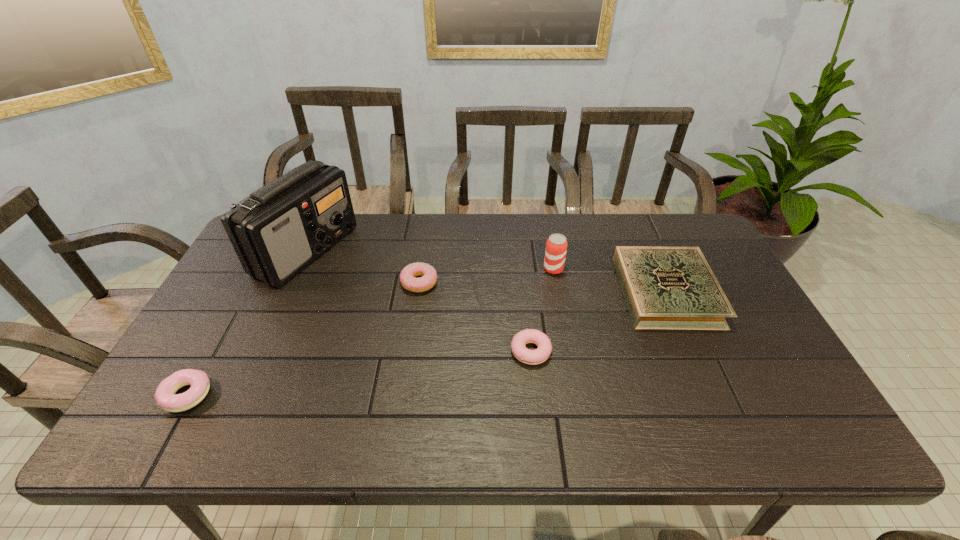
In order to click on empty location between the third object from left to right and the second object from right to left in this screenshot , I will do `click(487, 276)`.

Locate an element on the screen. The image size is (960, 540). unoccupied position between the second farthest doughnut and the tallest object is located at coordinates (419, 301).

The height and width of the screenshot is (540, 960). In order to click on free space that is in between the rightmost doughnut and the tallest object in this screenshot , I will do [x=419, y=301].

Identify the location of free area in between the second nearest doughnut and the fifth shortest object. This screenshot has height=540, width=960. (542, 310).

Image resolution: width=960 pixels, height=540 pixels. I want to click on free point between the second object from right to left and the rightmost object, so click(x=610, y=280).

Image resolution: width=960 pixels, height=540 pixels. I want to click on unoccupied area between the tallest object and the farthest doughnut, so click(x=363, y=267).

You are a GUI agent. You are given a task and a screenshot of the screen. Output one action in this format:
    pyautogui.click(x=<x>, y=<y>)
    Task: Click on the free point between the fifth object from left to right and the nearest doughnut
    Image resolution: width=960 pixels, height=540 pixels.
    Given the screenshot: What is the action you would take?
    pyautogui.click(x=371, y=332)

At what (x,y) coordinates should I click in order to perform the action: click on free spot between the third object from right to left and the fifth shortest object. Please return your answer as a coordinate pair (x, y). This screenshot has height=540, width=960. Looking at the image, I should click on (542, 310).

Identify the location of unoccupied position between the farthest doughnut and the tallest object. This screenshot has height=540, width=960. (x=363, y=267).

Select which object is the second closest to the third object from right to left. Please provide its 2D coordinates. Your answer should be formatted as a tuple, i.e. [(x, y)], where the tuple contains the x and y coordinates of a point satisfying the conditions above.

[(674, 288)]